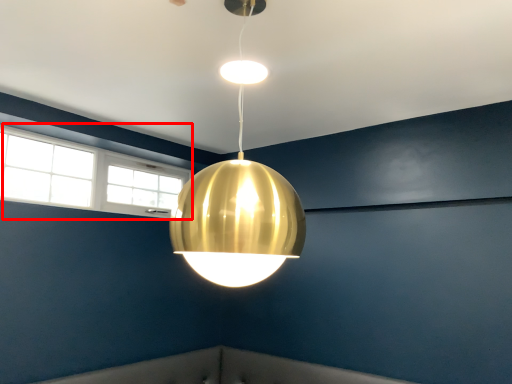
Question: From the image's perspective, where is window (annotated by the red box) located relative to lamp?

Choices:
 (A) below
 (B) above

Answer: (A)